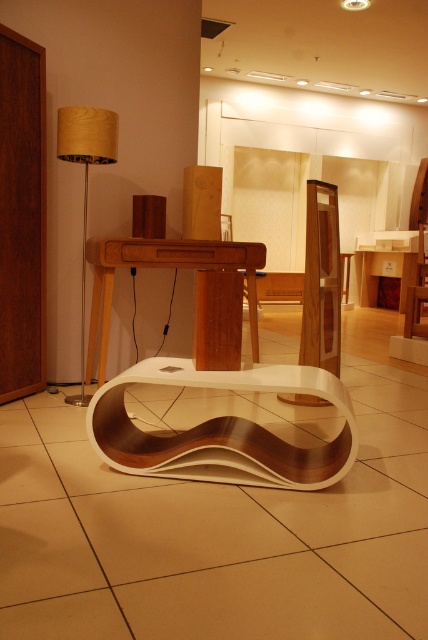
Question: Can you confirm if wooden fabric lampshade at left is wider than matte wood table at center?

Choices:
 (A) no
 (B) yes

Answer: (A)

Question: Which object is the farthest from the wooden fabric lampshade at left?

Choices:
 (A) matte wood table at center
 (B) white glossy coffee table at center
 (C) white glossy table at center

Answer: (A)

Question: Does white glossy table at center have a smaller size compared to matte wood table at center?

Choices:
 (A) no
 (B) yes

Answer: (B)

Question: Which of the following is the farthest from the observer?

Choices:
 (A) (332, 474)
 (B) (89, 154)
 (C) (394, 260)
 (D) (169, 266)

Answer: (C)

Question: Which of the following is the farthest from the observer?

Choices:
 (A) (363, 273)
 (B) (226, 252)

Answer: (A)

Question: From the image, what is the correct spatial relationship of white glossy table at center in relation to wooden fabric lampshade at left?

Choices:
 (A) left
 (B) right

Answer: (B)